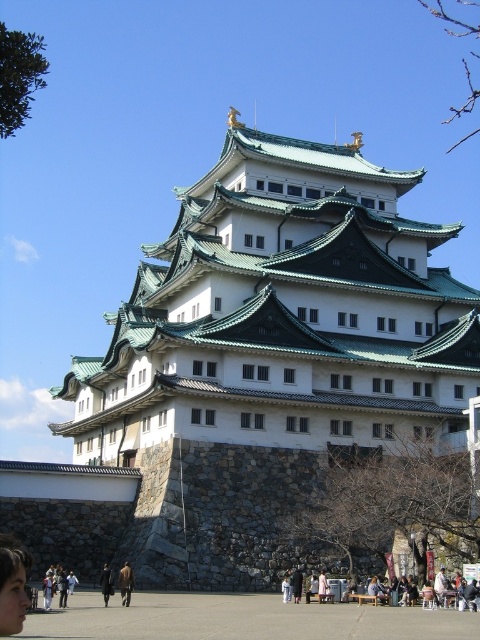
Question: Can you confirm if brown leather jacket at lower center is thinner than light brown leather jacket at lower left?

Choices:
 (A) no
 (B) yes

Answer: (B)

Question: Which point is farther to the camera?

Choices:
 (A) (322, 573)
 (B) (43, 579)

Answer: (B)

Question: Does brown leather jacket at lower center appear under light pink fabric dress at center?

Choices:
 (A) yes
 (B) no

Answer: (A)

Question: Among these points, which one is nearest to the camera?

Choices:
 (A) (75, 577)
 (B) (322, 572)

Answer: (A)

Question: Does smooth skin face at lower left have a larger size compared to dark brown leather coat at center?

Choices:
 (A) yes
 (B) no

Answer: (B)

Question: Considering the real-world distances, which object is farthest from the brown leather jacket at lower center?

Choices:
 (A) dark brown leather coat at center
 (B) light pink fabric dress at center

Answer: (B)